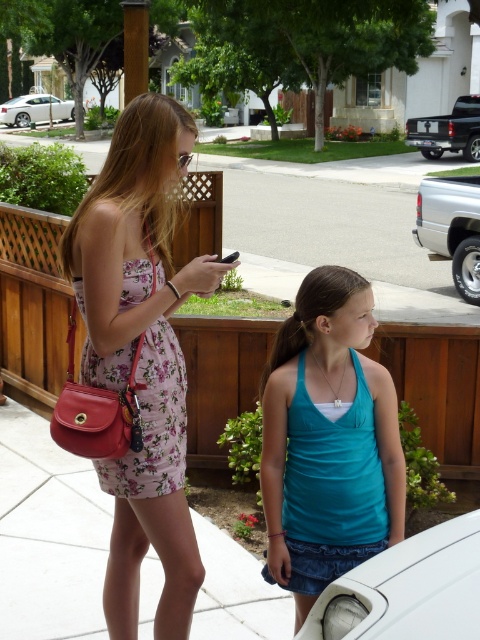
Is matte pink dress at lower center smaller than white concrete pavement at center?

Yes, matte pink dress at lower center is smaller than white concrete pavement at center.

Is matte pink dress at lower center to the left of white concrete pavement at center from the viewer's perspective?

Indeed, matte pink dress at lower center is positioned on the left side of white concrete pavement at center.

Is point (59, 608) closer to camera compared to point (445, 285)?

Yes, point (59, 608) is closer to viewer.

The height and width of the screenshot is (640, 480). I want to click on matte pink dress at lower center, so click(x=48, y=534).

Is matte pink dress at lower center positioned at the back of white glossy sedan at upper left?

No, matte pink dress at lower center is in front of white glossy sedan at upper left.

Between matte pink dress at lower center and white glossy sedan at upper left, which one is positioned lower?

matte pink dress at lower center is lower down.

Between point (51, 502) and point (17, 108), which one is positioned in front?

Positioned in front is point (51, 502).

Identify the location of matte pink dress at lower center. This screenshot has width=480, height=640. (48, 534).

Does point (302, 605) lie in front of point (239, 189)?

Yes, point (302, 605) is in front of point (239, 189).

Is teal fabric tank top at center bigger than white concrete pavement at center?

Actually, teal fabric tank top at center might be smaller than white concrete pavement at center.

The height and width of the screenshot is (640, 480). Identify the location of teal fabric tank top at center. (327, 440).

You are a GUI agent. You are given a task and a screenshot of the screen. Output one action in this format:
    pyautogui.click(x=<x>, y=<y>)
    Task: Click on the teal fabric tank top at center
    
    Given the screenshot: What is the action you would take?
    pyautogui.click(x=327, y=440)